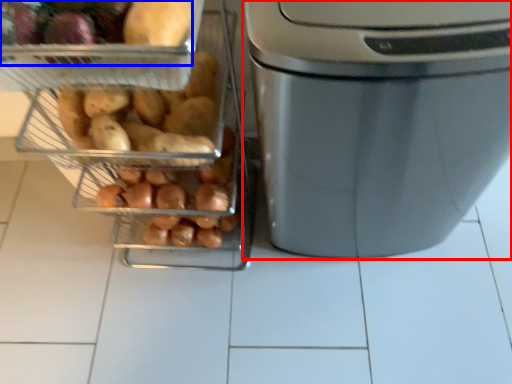
Question: Which object appears closest to the camera in this image, home appliance (highlighted by a red box) or food (highlighted by a blue box)?

Choices:
 (A) home appliance
 (B) food

Answer: (A)